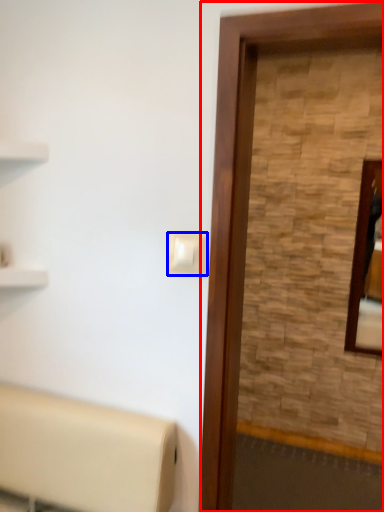
Question: Which point is further to the camera, screen door (highlighted by a red box) or light switch (highlighted by a blue box)?

Choices:
 (A) screen door
 (B) light switch

Answer: (B)